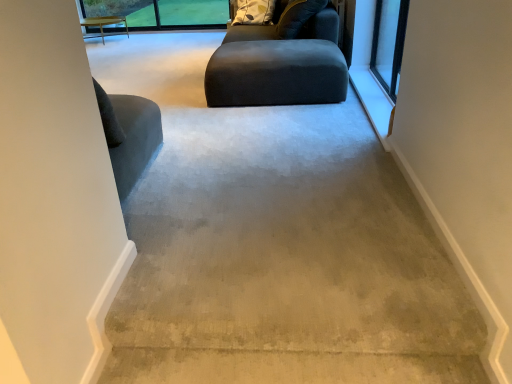
Question: From a real-world perspective, is matte black ottoman at center on top of dark gray fabric bean bag at center?

Choices:
 (A) no
 (B) yes

Answer: (A)

Question: Is matte black ottoman at center far from dark gray fabric bean bag at center?

Choices:
 (A) no
 (B) yes

Answer: (A)

Question: Is matte black ottoman at center taller than dark gray fabric bean bag at center?

Choices:
 (A) no
 (B) yes

Answer: (A)

Question: Considering the relative sizes of matte black ottoman at center and dark gray fabric bean bag at center in the image provided, is matte black ottoman at center wider than dark gray fabric bean bag at center?

Choices:
 (A) no
 (B) yes

Answer: (B)

Question: Is matte black ottoman at center outside of dark gray fabric bean bag at center?

Choices:
 (A) yes
 (B) no

Answer: (A)

Question: Does matte black ottoman at center lie behind dark gray fabric bean bag at center?

Choices:
 (A) yes
 (B) no

Answer: (B)

Question: Is clear glass window at upper right taller than light wood table at upper left?

Choices:
 (A) yes
 (B) no

Answer: (A)

Question: Is clear glass window at upper right facing towards light wood table at upper left?

Choices:
 (A) no
 (B) yes

Answer: (A)

Question: Is clear glass window at upper right oriented away from light wood table at upper left?

Choices:
 (A) no
 (B) yes

Answer: (A)

Question: Is clear glass window at upper right far away from light wood table at upper left?

Choices:
 (A) yes
 (B) no

Answer: (A)

Question: Is the position of clear glass window at upper right more distant than that of light wood table at upper left?

Choices:
 (A) yes
 (B) no

Answer: (B)

Question: Is clear glass window at upper right outside of light wood table at upper left?

Choices:
 (A) yes
 (B) no

Answer: (A)

Question: Can you confirm if dark gray fabric bean bag at center is shorter than matte black ottoman at center?

Choices:
 (A) no
 (B) yes

Answer: (A)